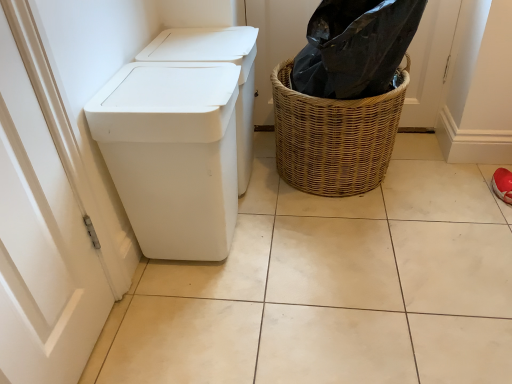
Locate an element on the screen. The image size is (512, 384). vacant area that is situated to the right of white plastic waste container at left is located at coordinates [x=290, y=246].